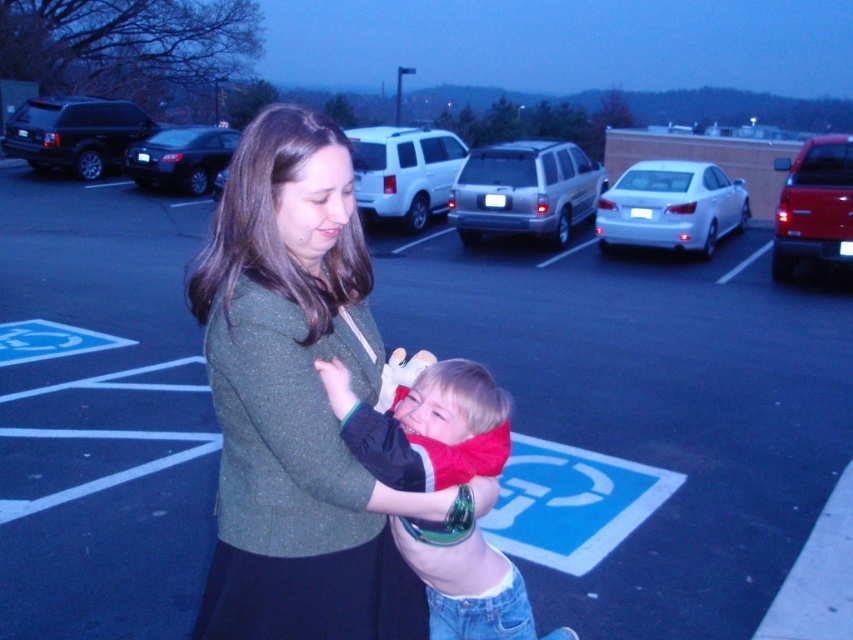
You are a delivery person trying to find the parking spot closest to the entrance. You see the black matte suv at upper left and the shiny black sedan at center. Which vehicle is positioned higher up in the image?

The black matte suv at upper left is above the shiny black sedan at center, so it is positioned higher up in the image.

You are a delivery person trying to park your van in this parking lot. You see the black matte suv at upper left and the shiny black sedan at center. Which vehicle should you avoid parking too close to if you want to leave first in the morning?

The black matte suv at upper left is larger in size compared to the shiny black sedan at center. Therefore, you should avoid parking too close to the black matte suv at upper left because its larger size may require more space to maneuver when leaving.

You are standing at the camera position looking at the scene. There are two points in the image labeled as point 1 at coordinates (393, 531) and point 2 at coordinates (38, 148). Which point is closer to you?

Point 1 at coordinates (393, 531) is closer to you because it is nearer to the camera position compared to point 2 at coordinates (38, 148).